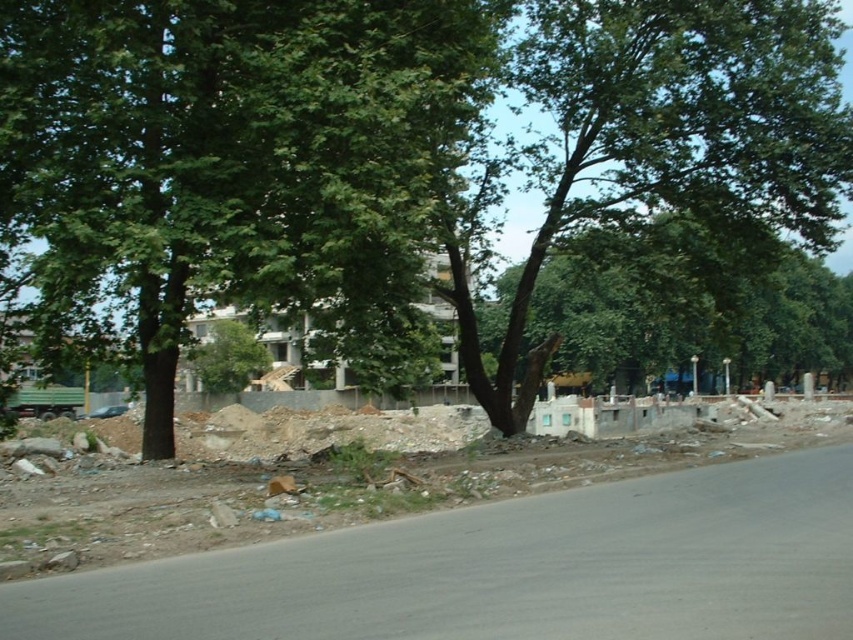
You are a city planner reviewing this urban landscape. You notice the concrete rubble at center and the green leafy tree at upper left. Which object occupies a larger area in the image?

The green leafy tree at upper left occupies a larger area in the image compared to the concrete rubble at center, as the concrete rubble at center has a smaller size compared to green leafy tree at upper left.

You are a delivery driver who needs to navigate through the urban landscape shown. There is a concrete rubble at center at point (456, 541). Is the concrete rubble at center in the road or on the grass and dirt area?

The concrete rubble at center is located at point (456, 541), which is in the road area as the road is in the foreground and stretches across the lower portion of the frame, while the grass and dirt area is a border along the road. Since the rubble is at center, it would be on the road.

You are a construction worker planning to place a heavy equipment on the concrete rubble at center. Considering the green leafy tree at upper left, is there a risk of the equipment damaging the tree if placed there?

The concrete rubble at center is positioned under the green leafy tree at upper left. Placing heavy equipment there could potentially damage the tree by compacting the soil around its roots or causing physical harm to the trunk or branches.